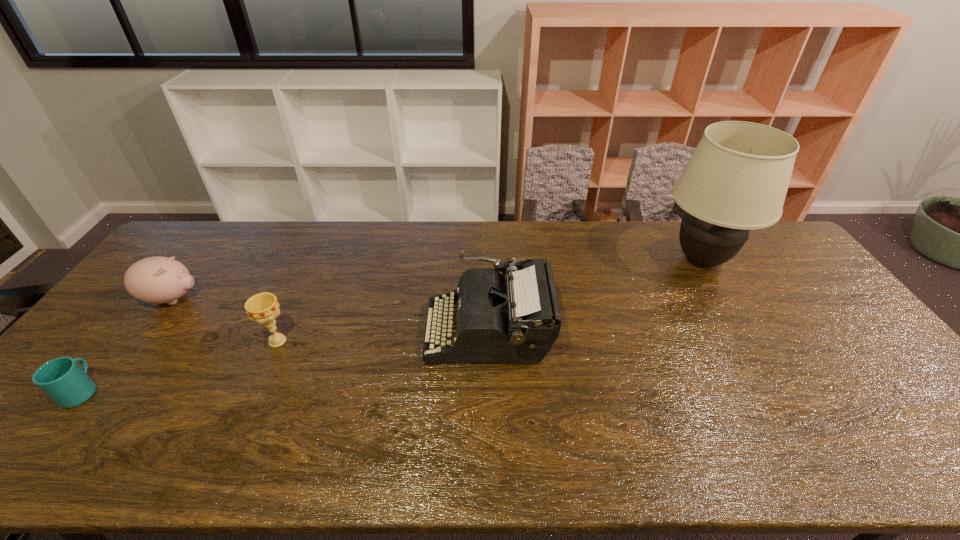
Locate an element on the screen. the rightmost object is located at coordinates (737, 178).

This screenshot has height=540, width=960. What are the coordinates of `the tallest object` in the screenshot? It's located at (737, 178).

The image size is (960, 540). I want to click on the fourth shortest object, so click(x=518, y=321).

Identify the location of typewriter. The height and width of the screenshot is (540, 960). (518, 321).

Where is `chalice`? Image resolution: width=960 pixels, height=540 pixels. chalice is located at coordinates (263, 308).

Find the location of `piggy bank`. piggy bank is located at coordinates (157, 280).

This screenshot has height=540, width=960. In order to click on the shortest object in this screenshot , I will do `click(67, 384)`.

This screenshot has width=960, height=540. In order to click on blank space located on the left of the tallest object in this screenshot , I will do `click(560, 261)`.

Image resolution: width=960 pixels, height=540 pixels. What are the coordinates of `free point located 0.250m on the front-facing side of the second object from right to left` in the screenshot? It's located at (338, 330).

Identify the location of vacant space situated on the front-facing side of the second object from right to left. (409, 330).